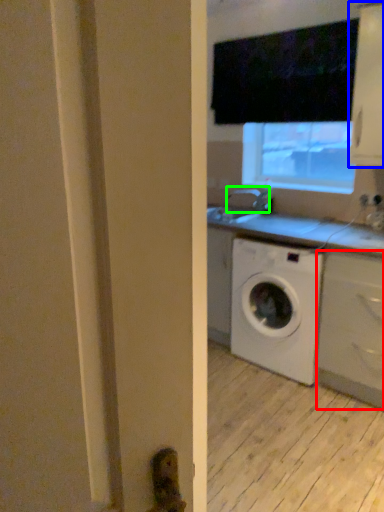
Question: Which object is the closest to the cabinetry (highlighted by a red box)? Choose among these: cabinetry (highlighted by a blue box) or faucet (highlighted by a green box).

Choices:
 (A) cabinetry
 (B) faucet

Answer: (A)